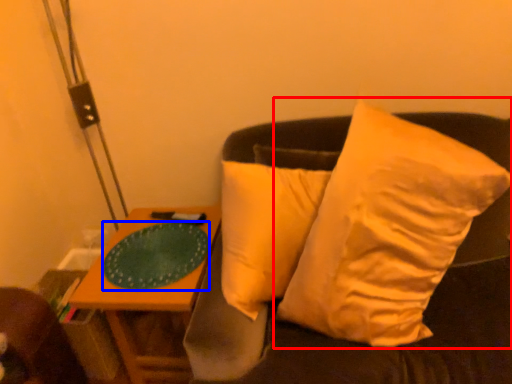
Question: Among these objects, which one is farthest to the camera, pillow (highlighted by a red box) or glass plate (highlighted by a blue box)?

Choices:
 (A) pillow
 (B) glass plate

Answer: (B)